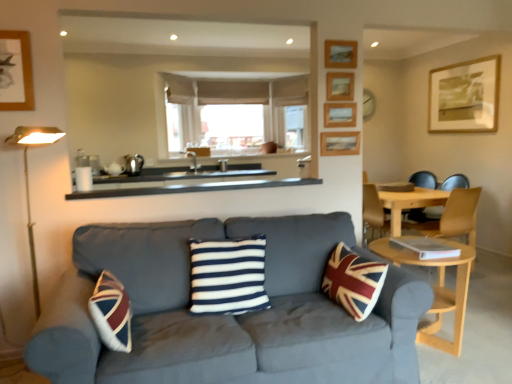
The width and height of the screenshot is (512, 384). What do you see at coordinates (234, 113) in the screenshot?
I see `white matte window frame at center` at bounding box center [234, 113].

This screenshot has width=512, height=384. What do you see at coordinates (228, 276) in the screenshot?
I see `white and navy striped cushion at center` at bounding box center [228, 276].

You are a GUI agent. You are given a task and a screenshot of the screen. Output one action in this format:
    pyautogui.click(x=<x>, y=<y>)
    Task: Click on the black matte counter top at center
    
    Given the screenshot: What is the action you would take?
    pyautogui.click(x=193, y=188)

This screenshot has width=512, height=384. What are the coordinates of `white matte window frame at center` in the screenshot? It's located at (234, 113).

Does wooden framed picture at upper right, marked as the first picture frame in a back-to-front arrangement, touch white matte window frame at center?

No.

Is wooden framed picture at upper right, which appears as the first picture frame when viewed from the right, to the left or to the right of white matte window frame at center in the image?

Based on their positions, wooden framed picture at upper right, which appears as the first picture frame when viewed from the right, is located to the right of white matte window frame at center.

Which object is wider, wooden framed picture at upper right, marked as the first picture frame in a back-to-front arrangement, or white matte window frame at center?

Wider between the two is white matte window frame at center.

Can you confirm if wooden framed picture at upper right, which ranks as the 5th picture frame in front-to-back order, is shorter than white matte window frame at center?

Indeed, wooden framed picture at upper right, which ranks as the 5th picture frame in front-to-back order, has a lesser height compared to white matte window frame at center.

Does point (163, 225) appear closer or farther from the camera than point (324, 119)?

Point (163, 225) is closer to the camera than point (324, 119).

From a real-world perspective, is velvet blue couch at center physically located above or below wooden picture frame at upper center, which ranks as the third picture frame in left-to-right order?

In terms of real-world spatial position, velvet blue couch at center is below wooden picture frame at upper center, which ranks as the third picture frame in left-to-right order.

From the image's perspective, which is below, velvet blue couch at center or wooden picture frame at upper center, which ranks as the third picture frame in left-to-right order?

From the image's view, velvet blue couch at center is below.

This screenshot has height=384, width=512. What are the coordinates of `the 3rd picture frame behind the velvet blue couch at center` in the screenshot? It's located at (339, 115).

Which of these two, light brown wooden chair at right or light wood round table at lower right, stands taller?

light brown wooden chair at right is taller.

Considering the relative positions of light brown wooden chair at right and light wood round table at lower right in the image provided, is light brown wooden chair at right to the left of light wood round table at lower right from the viewer's perspective?

No.

Is light brown wooden chair at right aimed at light wood round table at lower right?

No, light brown wooden chair at right is not aimed at light wood round table at lower right.

Considering the positions of objects wooden picture frame at upper center, arranged as the 4th picture frame when viewed from the front, and white and navy striped cushion at center in the image provided, who is more to the left, wooden picture frame at upper center, arranged as the 4th picture frame when viewed from the front, or white and navy striped cushion at center?

Positioned to the left is white and navy striped cushion at center.

Is wooden picture frame at upper center, the 2th picture frame when ordered from right to left, positioned far away from white and navy striped cushion at center?

Indeed, wooden picture frame at upper center, the 2th picture frame when ordered from right to left, is not near white and navy striped cushion at center.

Where is `pillow lying below the wooden picture frame at upper center, arranged as the 4th picture frame when viewed from the front (from the image's perspective)`? The height and width of the screenshot is (384, 512). pillow lying below the wooden picture frame at upper center, arranged as the 4th picture frame when viewed from the front (from the image's perspective) is located at coordinates (228, 276).

Considering the relative sizes of black matte counter top at center and wooden picture frame at upper right, which is the 5th picture frame from back to front, in the image provided, is black matte counter top at center taller than wooden picture frame at upper right, which is the 5th picture frame from back to front,?

In fact, black matte counter top at center may be shorter than wooden picture frame at upper right, which is the 5th picture frame from back to front.

Measure the distance between black matte counter top at center and wooden picture frame at upper right, arranged as the 1th picture frame when viewed from the left.

The distance of black matte counter top at center from wooden picture frame at upper right, arranged as the 1th picture frame when viewed from the left, is 1.04 meters.

Is black matte counter top at center thinner than wooden picture frame at upper right, arranged as the 1th picture frame when viewed from the left?

No.

Does point (68, 199) come closer to viewer compared to point (350, 43)?

Yes.

Considering the positions of objects velvet blue couch at center and light wood round table at lower right in the image provided, who is more to the right, velvet blue couch at center or light wood round table at lower right?

From the viewer's perspective, light wood round table at lower right appears more on the right side.

Which is in front, point (252, 381) or point (394, 260)?

The point (252, 381) is more forward.

Who is more distant, velvet blue couch at center or light wood round table at lower right?

light wood round table at lower right is behind.

Which object is wider, velvet blue couch at center or light wood round table at lower right?

With larger width is velvet blue couch at center.

How far apart are white matte window frame at center and wooden framed picture at upper right, positioned as the 5th picture frame in left-to-right order?

white matte window frame at center and wooden framed picture at upper right, positioned as the 5th picture frame in left-to-right order, are 2.53 meters apart from each other.

Does white matte window frame at center touch wooden framed picture at upper right, positioned as the 5th picture frame in left-to-right order?

white matte window frame at center and wooden framed picture at upper right, positioned as the 5th picture frame in left-to-right order, are not in contact.

Looking at their sizes, would you say white matte window frame at center is wider or thinner than wooden framed picture at upper right, which ranks as the 5th picture frame in front-to-back order?

Considering their sizes, white matte window frame at center looks broader than wooden framed picture at upper right, which ranks as the 5th picture frame in front-to-back order.

From the image's perspective, is white matte window frame at center beneath wooden framed picture at upper right, positioned as the 5th picture frame in left-to-right order?

Yes, from the image's perspective, white matte window frame at center is beneath wooden framed picture at upper right, positioned as the 5th picture frame in left-to-right order.

Where is `the 5th picture frame counting from the right of the white matte window frame at center`? This screenshot has height=384, width=512. the 5th picture frame counting from the right of the white matte window frame at center is located at coordinates (464, 97).

From the velvet blue couch at center, count 3rd picture frames backward and point to it. Please provide its 2D coordinates.

[(339, 115)]

Estimate the real-world distances between objects in this image. Which object is further from wooden picture frame at upper center, which is counted as the 3th picture frame, starting from the back, white and navy striped cushion at center or black matte counter top at center?

white and navy striped cushion at center.

When comparing their distances from wooden picture frame at upper right, arranged as the 1th picture frame when viewed from the left, does black matte counter top at center or wooden picture frame at upper center, the 2th picture frame when ordered from back to front, seem closer?

wooden picture frame at upper center, the 2th picture frame when ordered from back to front.

Looking at the image, which one is located closer to wooden picture frame at upper center, the 4th picture frame when ordered from back to front, white matte window frame at center or light wood round table at lower right?

Based on the image, light wood round table at lower right appears to be nearer to wooden picture frame at upper center, the 4th picture frame when ordered from back to front.

Consider the image. Which object lies nearer to the anchor point wooden picture frame at upper center, which is the 3th picture frame from right to left, light wood round table at lower right or velvet blue couch at center?

light wood round table at lower right lies closer to wooden picture frame at upper center, which is the 3th picture frame from right to left, than the other object.

When comparing their distances from wooden picture frame at upper center, the 2th picture frame when ordered from right to left, does light brown wooden chair at right or wooden picture frame at upper center, which ranks as the third picture frame in left-to-right order, seem further?

light brown wooden chair at right.

From the image, which object appears to be nearer to wooden framed picture at upper right, marked as the first picture frame in a back-to-front arrangement, wooden picture frame at upper center, which is counted as the third picture frame, starting from the front, or velvet blue couch at center?

wooden picture frame at upper center, which is counted as the third picture frame, starting from the front.

Estimate the real-world distances between objects in this image. Which object is closer to black matte counter top at center, wooden picture frame at upper right, the 5th picture frame from the right, or white and navy striped cushion at center?

white and navy striped cushion at center.

Considering their positions, is wooden picture frame at upper center, the 4th picture frame when ordered from back to front, positioned closer to black matte counter top at center than white and navy striped cushion at center?

Among the two, wooden picture frame at upper center, the 4th picture frame when ordered from back to front, is located nearer to black matte counter top at center.

What are the coordinates of `studio couch between wooden picture frame at upper right, arranged as the 1th picture frame when viewed from the left, and light wood round table at lower right vertically` in the screenshot? It's located at (228, 316).

You are a GUI agent. You are given a task and a screenshot of the screen. Output one action in this format:
    pyautogui.click(x=<x>, y=<y>)
    Task: Click on the picture frame that lies between wooden picture frame at upper center, the 4th picture frame when ordered from back to front, and wooden picture frame at upper center, the 2th picture frame when ordered from right to left, from top to bottom
    
    Given the screenshot: What is the action you would take?
    pyautogui.click(x=339, y=115)

At what (x,y) coordinates should I click in order to perform the action: click on studio couch between black matte counter top at center and wooden framed picture at upper right, which appears as the first picture frame when viewed from the right, from left to right. Please return your answer as a coordinate pair (x, y). Looking at the image, I should click on (228, 316).

This screenshot has width=512, height=384. Find the location of `pillow between wooden picture frame at upper right, arranged as the 1th picture frame when viewed from the left, and velvet blue couch at center from top to bottom`. pillow between wooden picture frame at upper right, arranged as the 1th picture frame when viewed from the left, and velvet blue couch at center from top to bottom is located at coordinates (228, 276).